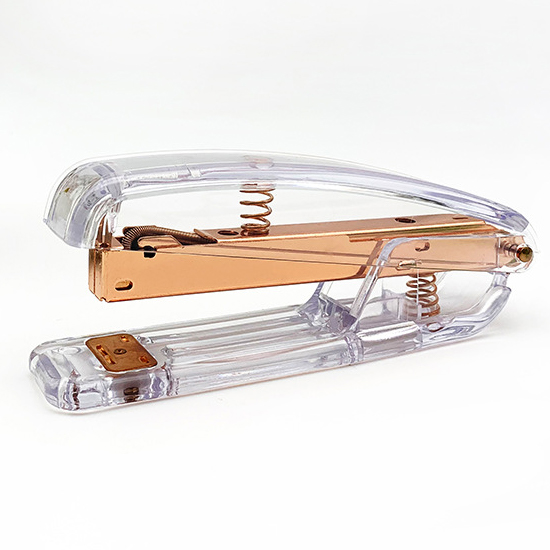
At what (x,y) coordinates should I click in order to perform the action: click on hinge. Please return your answer as a coordinate pair (x, y). The height and width of the screenshot is (550, 550). Looking at the image, I should click on (504, 242).